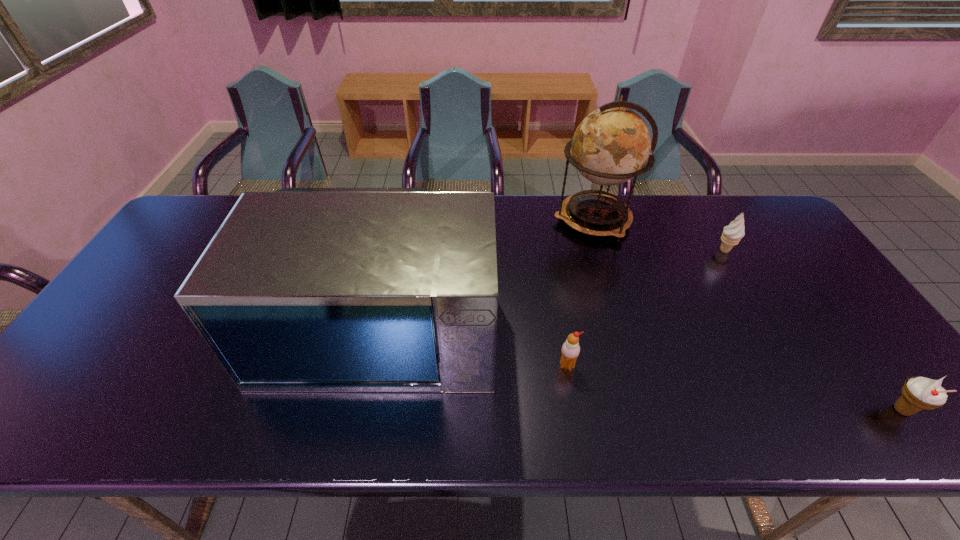
In order to click on vacant space that satisfies the following two spatial constraints: 1. on the back side of the rightmost icecream; 2. on the front-facing side of the second icecream from left to right in this screenshot , I will do `click(785, 251)`.

This screenshot has height=540, width=960. I want to click on vacant space that satisfies the following two spatial constraints: 1. on the back side of the nearest icecream; 2. at the center of the tallest object, so click(x=762, y=220).

Locate an element on the screen. The height and width of the screenshot is (540, 960). vacant area in the image that satisfies the following two spatial constraints: 1. on the front-facing side of the farthest icecream; 2. on the front-facing side of the leftmost object is located at coordinates (766, 321).

The height and width of the screenshot is (540, 960). Find the location of `vacant area that satisfies the following two spatial constraints: 1. on the front-facing side of the fourth object from left to right; 2. at the front with a straw on the second farthest icecream`. vacant area that satisfies the following two spatial constraints: 1. on the front-facing side of the fourth object from left to right; 2. at the front with a straw on the second farthest icecream is located at coordinates coord(793,366).